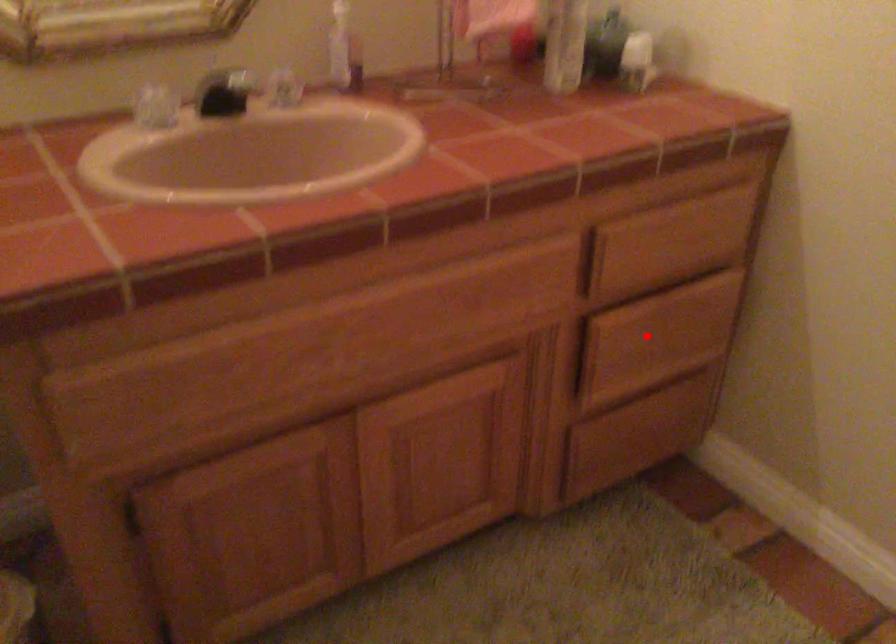
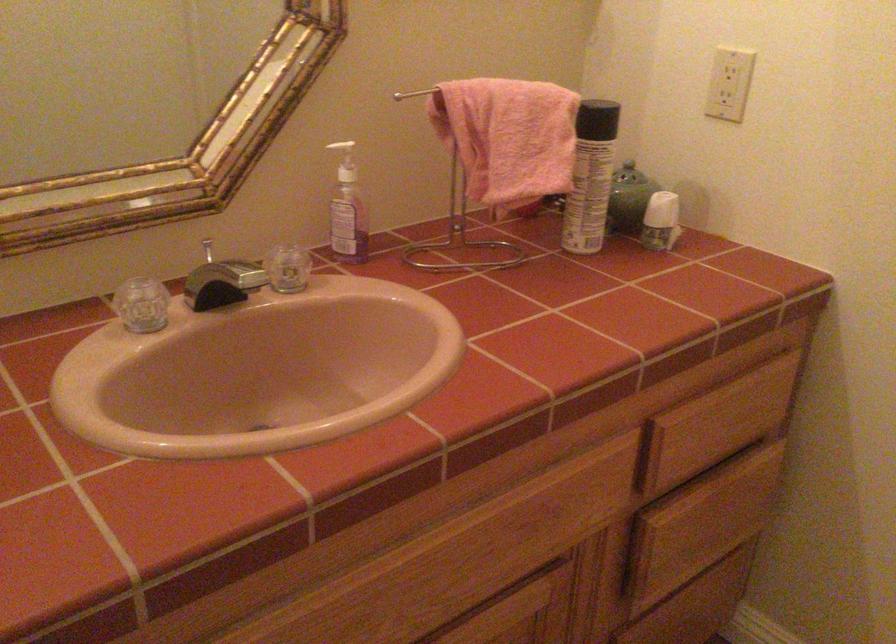
Question: I am providing you with two images of the same scene from different viewpoints. A red point is shown in image1. For the corresponding object point in image2, is it positioned nearer or farther from the camera?

Choices:
 (A) Nearer
 (B) Farther

Answer: (A)